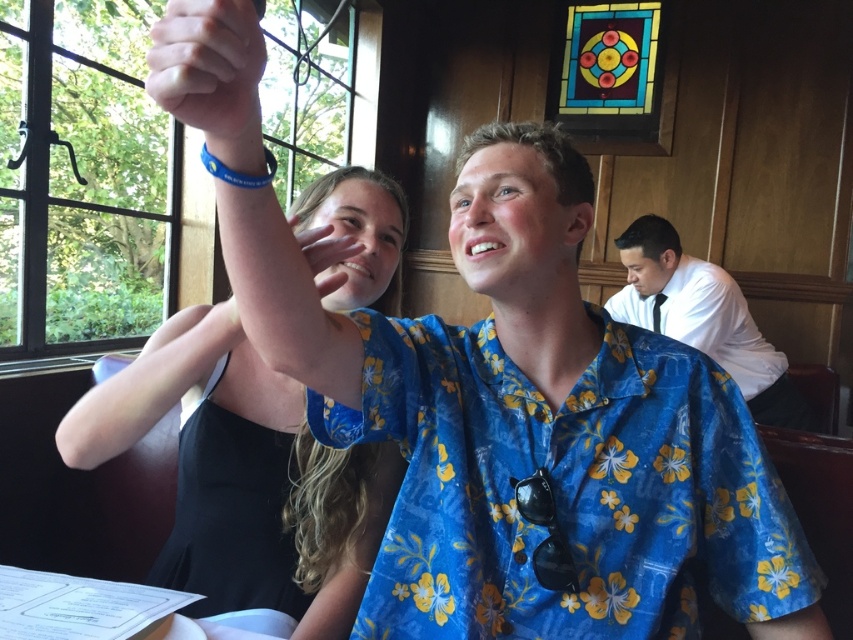
Is blue floral shirt at center positioned before black matte dress at upper left?

No, it is behind black matte dress at upper left.

Based on the photo, who is shorter, blue floral shirt at center or black matte dress at upper left?

Standing shorter between the two is blue floral shirt at center.

Where is `blue floral shirt at center`? This screenshot has height=640, width=853. blue floral shirt at center is located at coordinates (566, 490).

Identify the location of blue floral shirt at center. (566, 490).

Is white shirt at right wider than matte blue wristband at upper center?

Indeed, white shirt at right has a greater width compared to matte blue wristband at upper center.

Describe the element at coordinates (703, 317) in the screenshot. I see `white shirt at right` at that location.

Between point (636, 292) and point (213, 125), which one is positioned in front?

Point (213, 125)

Identify the location of white shirt at right. (703, 317).

Can you confirm if white shirt at right is positioned to the right of matte skin hand at upper center?

Correct, you'll find white shirt at right to the right of matte skin hand at upper center.

Can you confirm if white shirt at right is positioned below matte skin hand at upper center?

Yes.

Is point (759, 394) closer to camera compared to point (303, 259)?

No, it is behind (303, 259).

At what (x,y) coordinates should I click in order to perform the action: click on white shirt at right. Please return your answer as a coordinate pair (x, y). The width and height of the screenshot is (853, 640). Looking at the image, I should click on (703, 317).